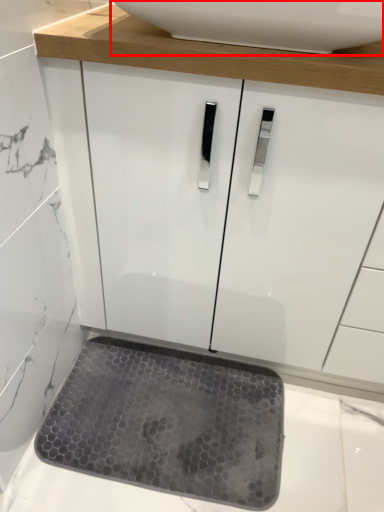
Question: From the image's perspective, where is sink (annotated by the red box) located relative to mat?

Choices:
 (A) below
 (B) above

Answer: (B)